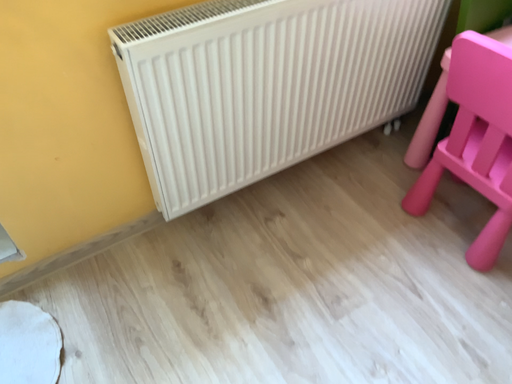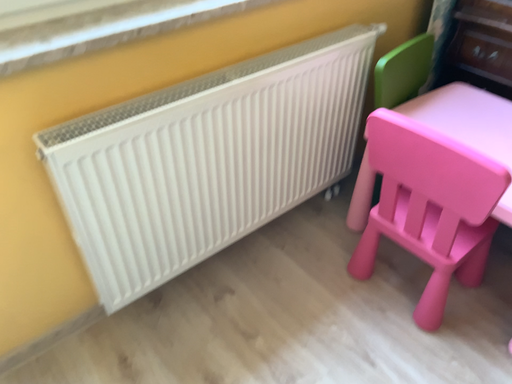
Question: How did the camera likely rotate when shooting the video?

Choices:
 (A) rotated upward
 (B) rotated downward

Answer: (A)